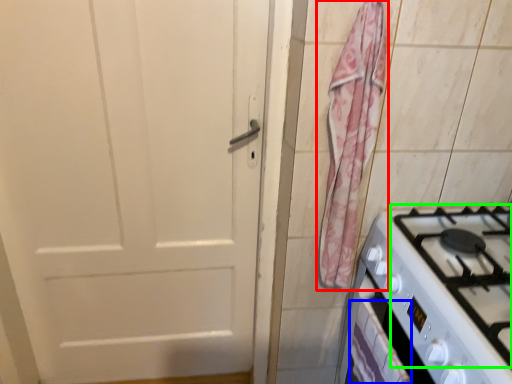
Question: Which is nearer to the curtain (highlighted by a red box)? drawer (highlighted by a blue box) or gas stove (highlighted by a green box).

Choices:
 (A) drawer
 (B) gas stove

Answer: (B)